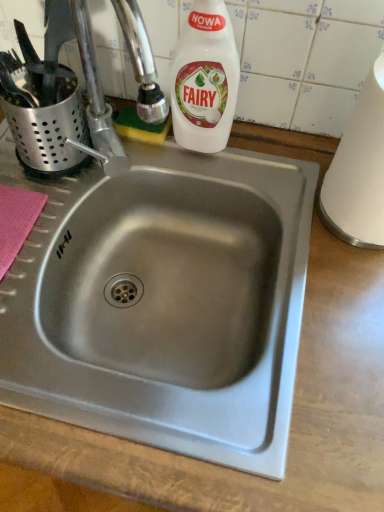
Locate an element on the screen. This screenshot has height=512, width=384. vacant position to the left of white matte paper towel at right is located at coordinates (265, 179).